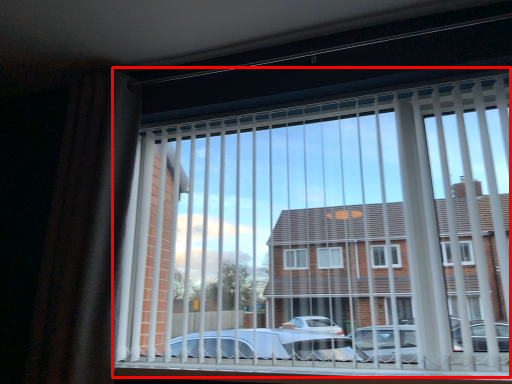
Question: Observing the image, what is the correct spatial positioning of window (annotated by the red box) in reference to curtain?

Choices:
 (A) right
 (B) left

Answer: (A)